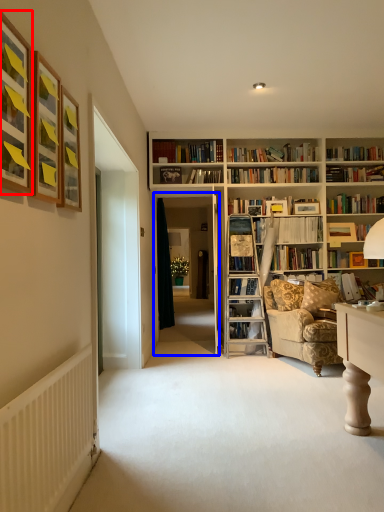
Question: Which object appears farthest to the camera in this image, picture frame (highlighted by a red box) or glass door (highlighted by a blue box)?

Choices:
 (A) picture frame
 (B) glass door

Answer: (B)